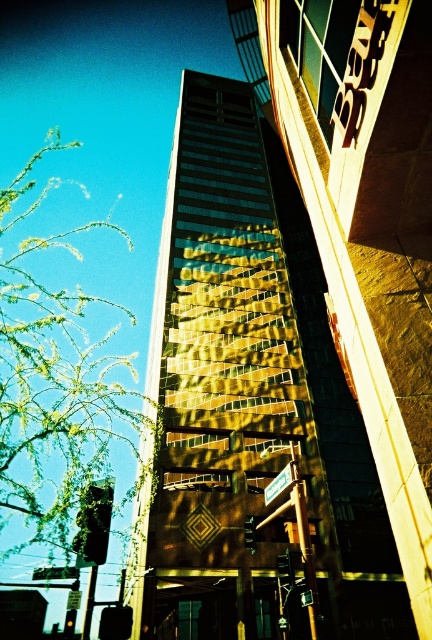
Question: Does gold reflective glass building at center have a greater width compared to green leafy branches at left?

Choices:
 (A) no
 (B) yes

Answer: (A)

Question: Which of the following is the farthest from the observer?

Choices:
 (A) gold reflective glass building at center
 (B) green leafy branches at left

Answer: (A)

Question: Which point is closer to the camera taking this photo?

Choices:
 (A) (50, 518)
 (B) (213, 634)

Answer: (A)

Question: Can you confirm if gold reflective glass building at center is wider than green leafy branches at left?

Choices:
 (A) yes
 (B) no

Answer: (B)

Question: Does gold reflective glass building at center appear on the left side of green leafy branches at left?

Choices:
 (A) no
 (B) yes

Answer: (A)

Question: Which point is closer to the camera?

Choices:
 (A) green leafy branches at left
 (B) gold reflective glass building at center

Answer: (A)